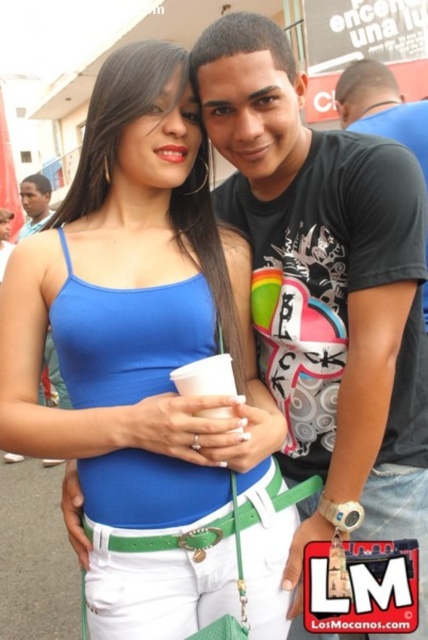
Question: Which point appears farthest from the camera in this image?

Choices:
 (A) (12, 342)
 (B) (291, 122)
 (C) (48, 184)

Answer: (C)

Question: Is matte blue tank top at center further to the viewer compared to matte black headband at upper left?

Choices:
 (A) no
 (B) yes

Answer: (A)

Question: Is black matte t-shirt at center to the right of matte black headband at upper left from the viewer's perspective?

Choices:
 (A) no
 (B) yes

Answer: (B)

Question: Estimate the real-world distances between objects in this image. Which object is closer to the matte blue tank top at center?

Choices:
 (A) matte black headband at upper left
 (B) black matte t-shirt at center

Answer: (B)

Question: Can you confirm if matte blue tank top at center is positioned to the left of matte black headband at upper left?

Choices:
 (A) yes
 (B) no

Answer: (B)

Question: Which object is positioned farthest from the black matte t-shirt at center?

Choices:
 (A) matte black headband at upper left
 (B) matte blue tank top at center

Answer: (A)